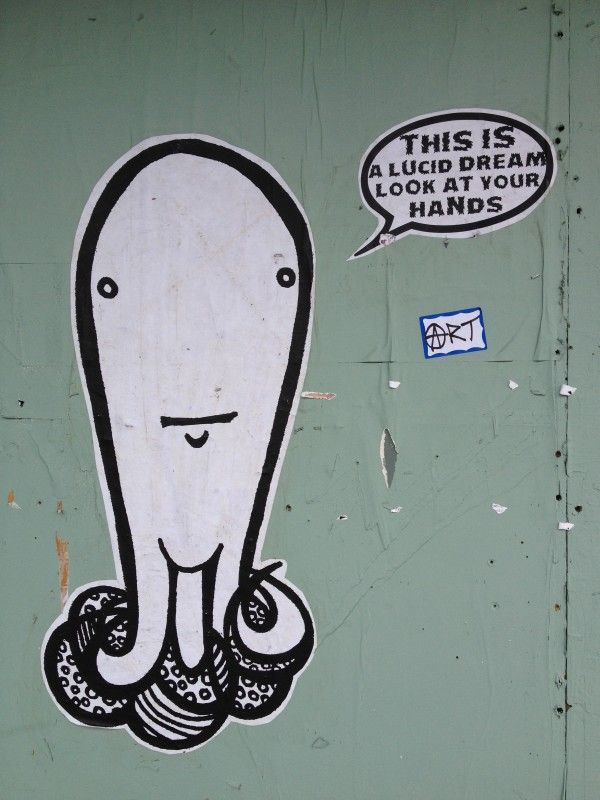
Identify the location of art sticker. This screenshot has height=800, width=600. (465, 337).